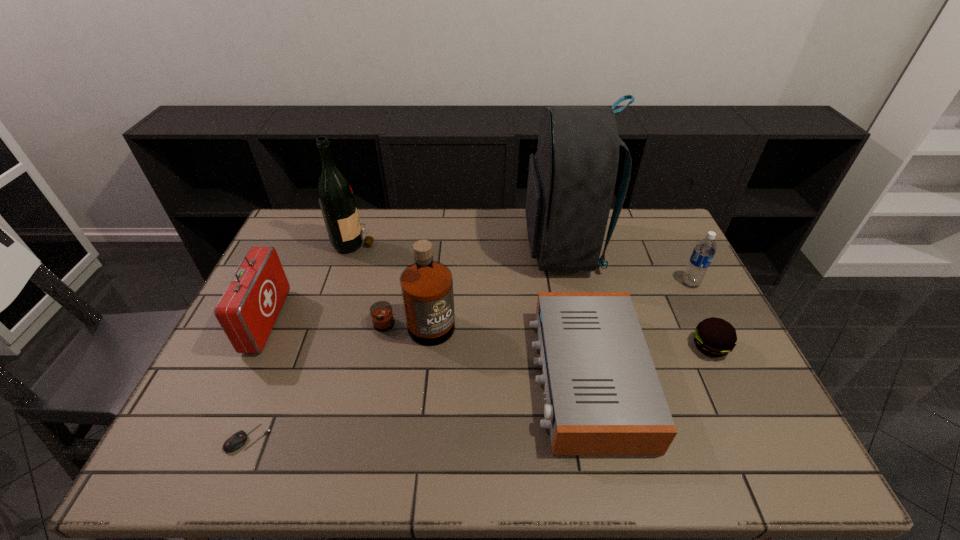
This screenshot has height=540, width=960. I want to click on free point located on the front-facing side of the backpack, so click(x=424, y=248).

You are a GUI agent. You are given a task and a screenshot of the screen. Output one action in this format:
    pyautogui.click(x=<x>, y=<y>)
    Task: Click on the vacant area situated on the front-facing side of the backpack
    The width and height of the screenshot is (960, 540).
    Given the screenshot: What is the action you would take?
    pyautogui.click(x=497, y=248)

Where is `vacant region located on the right of the wine bottle`? This screenshot has width=960, height=540. vacant region located on the right of the wine bottle is located at coordinates (461, 241).

Locate an element on the screen. This screenshot has height=540, width=960. blank space located 0.110m on the front label of the liquor is located at coordinates (406, 381).

This screenshot has height=540, width=960. What are the coordinates of `vacant space situated 0.390m on the side of the leftmost object with the first aid cross symbol` in the screenshot? It's located at (414, 321).

Where is `free space located 0.180m on the left of the water bottle`? The height and width of the screenshot is (540, 960). free space located 0.180m on the left of the water bottle is located at coordinates (624, 283).

This screenshot has height=540, width=960. I want to click on vacant region located 0.300m on the control panel of the third shortest object, so click(x=418, y=377).

Find the location of `blank space located on the control panel of the third shortest object`. blank space located on the control panel of the third shortest object is located at coordinates (378, 377).

At what (x,y) coordinates should I click in order to perform the action: click on free point located on the control panel of the third shortest object. Please return your answer as a coordinate pair (x, y). Looking at the image, I should click on (378, 377).

Locate an element on the screen. This screenshot has width=960, height=540. vacant space located on the left of the patty is located at coordinates (555, 347).